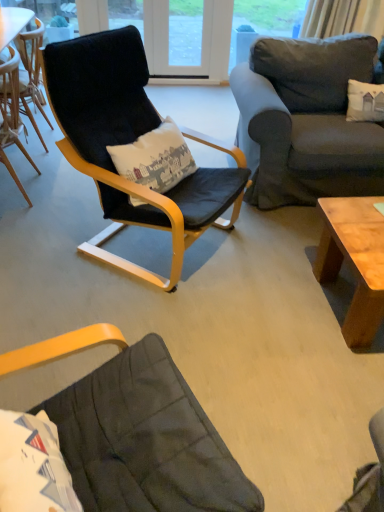
Where is `free spot in front of velvet black armchair at center, the second chair in the left-to-right sequence`? This screenshot has width=384, height=512. free spot in front of velvet black armchair at center, the second chair in the left-to-right sequence is located at coordinates (157, 323).